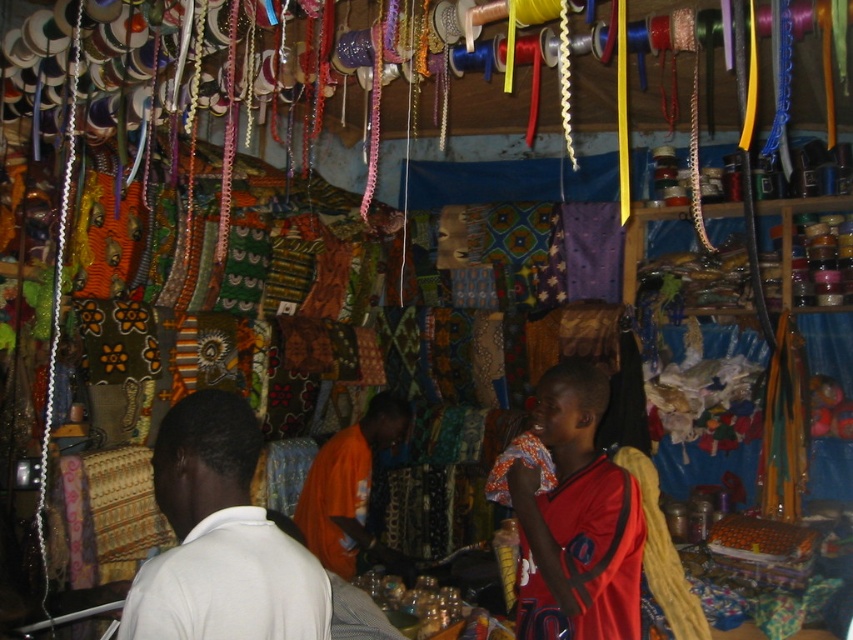
Question: Estimate the real-world distances between objects in this image. Which object is farther from the white matte shirt at center?

Choices:
 (A) orange fabric at center
 (B) red jersey at center

Answer: (A)

Question: Does red jersey at center have a larger size compared to orange fabric at center?

Choices:
 (A) no
 (B) yes

Answer: (A)

Question: Which object is the closest to the orange fabric at center?

Choices:
 (A) white matte shirt at center
 (B) red jersey at center

Answer: (B)

Question: Which object is closer to the camera taking this photo?

Choices:
 (A) white matte shirt at center
 (B) orange fabric at center

Answer: (A)

Question: Is the position of white matte shirt at center less distant than that of red jersey at center?

Choices:
 (A) yes
 (B) no

Answer: (A)

Question: Can you confirm if red jersey at center is bigger than orange fabric at center?

Choices:
 (A) no
 (B) yes

Answer: (A)